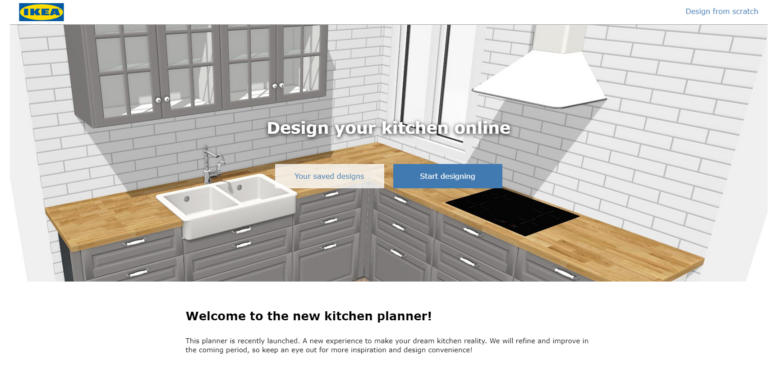
Show me all visible what i'd pull to open cabinet doors in the image. Your answer should be formatted as a list of tuples, i.e. [(x1, y1), (x2, y2), ...], where each tuple contains the x and y coordinates of a point satisfying the conditions above.

[(159, 100), (166, 97), (273, 87), (282, 86)]